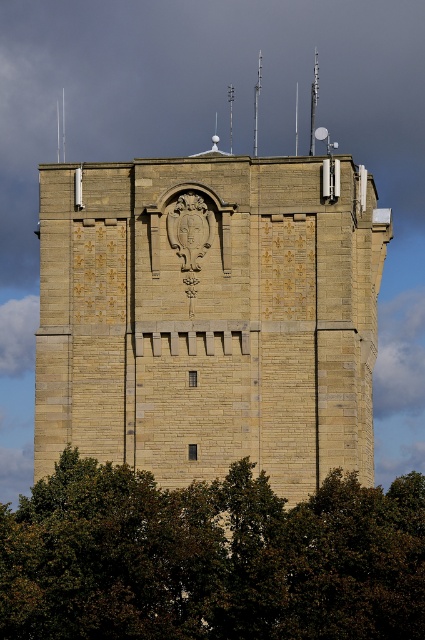
Is brown stone bell tower at center smaller than green leafy tree at lower center?

Incorrect, brown stone bell tower at center is not smaller in size than green leafy tree at lower center.

Which of these two, brown stone bell tower at center or green leafy tree at lower center, stands shorter?

green leafy tree at lower center is shorter.

Does point (136, 426) come farther from viewer compared to point (334, 525)?

Yes, point (136, 426) is behind point (334, 525).

This screenshot has height=640, width=425. Identify the location of brown stone bell tower at center. (209, 316).